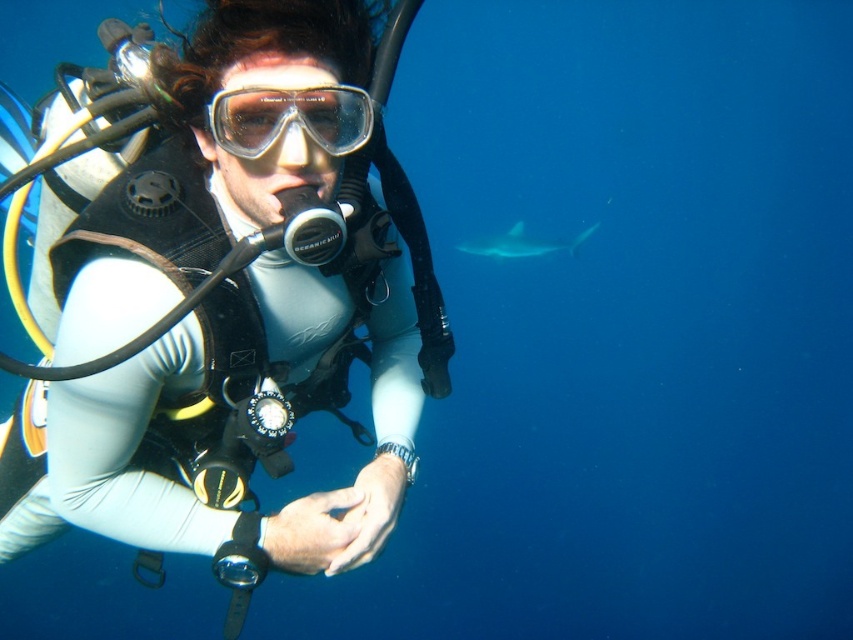
You are a marine biologist observing an underwater scene. You notice the white matte wetsuit at center and the gray matte shark at upper right. Which object is located to the right of the other?

The white matte wetsuit at center is positioned on the left side of gray matte shark at upper right, so the gray matte shark at upper right is to the right of the white matte wetsuit at center.